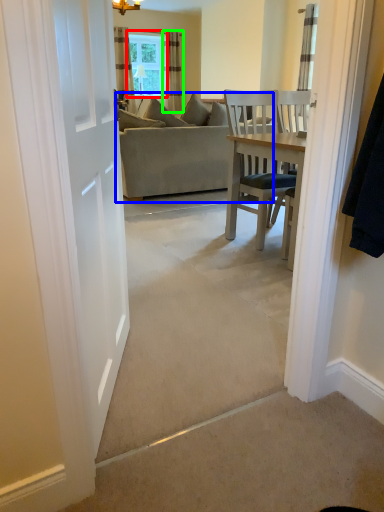
Question: Which object is the closest to the window (highlighted by a red box)? Choose among these: studio couch (highlighted by a blue box) or curtain (highlighted by a green box).

Choices:
 (A) studio couch
 (B) curtain

Answer: (B)